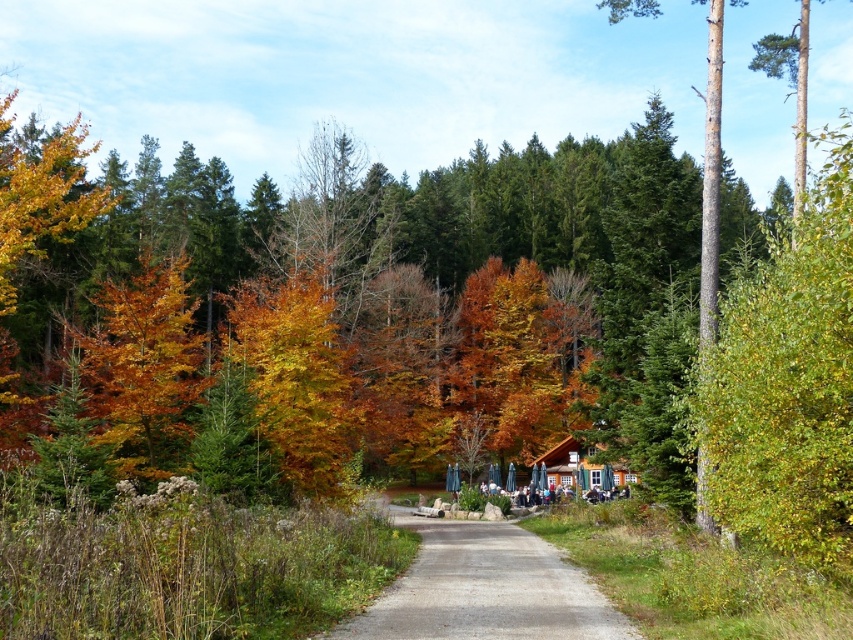
Looking at this image, you are planning to build a garden along the gray concrete path at center and the wooden cabin at center. Which area has more space available for planting?

The wooden cabin at center has more space available for planting because it occupies more area than the gray concrete path at center according to the description.

You are a hiker who wants to reach the wooden cabin at center from the gray concrete path at center. Which direction should you head?

You should head to the right because the gray concrete path at center is to the left of the wooden cabin at center, so moving right will lead you towards the cabin.